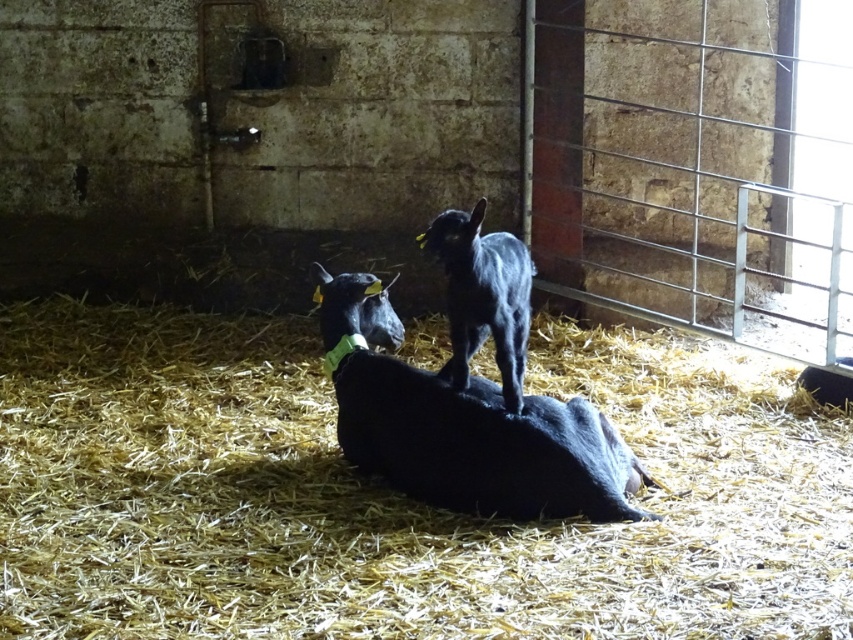
Is point (215, 419) farther from viewer compared to point (415, 456)?

Yes, it is behind point (415, 456).

Where is `yellow straw at center`? This screenshot has height=640, width=853. yellow straw at center is located at coordinates (393, 493).

Can you confirm if yellow straw at center is taller than black furry goat at center?

Indeed, yellow straw at center has a greater height compared to black furry goat at center.

Does yellow straw at center have a lesser width compared to black furry goat at center?

No.

Between point (746, 397) and point (520, 380), which one is positioned behind?

The point (746, 397) is more distant.

You are a GUI agent. You are given a task and a screenshot of the screen. Output one action in this format:
    pyautogui.click(x=<x>, y=<y>)
    Task: Click on the yellow straw at center
    This screenshot has height=640, width=853.
    Given the screenshot: What is the action you would take?
    pyautogui.click(x=393, y=493)

Which of these two, black matte goat at center or black furry goat at center, stands taller?

With more height is black matte goat at center.

Find the location of `black matte goat at center`. black matte goat at center is located at coordinates (466, 429).

This screenshot has height=640, width=853. In order to click on black matte goat at center in this screenshot , I will do `click(466, 429)`.